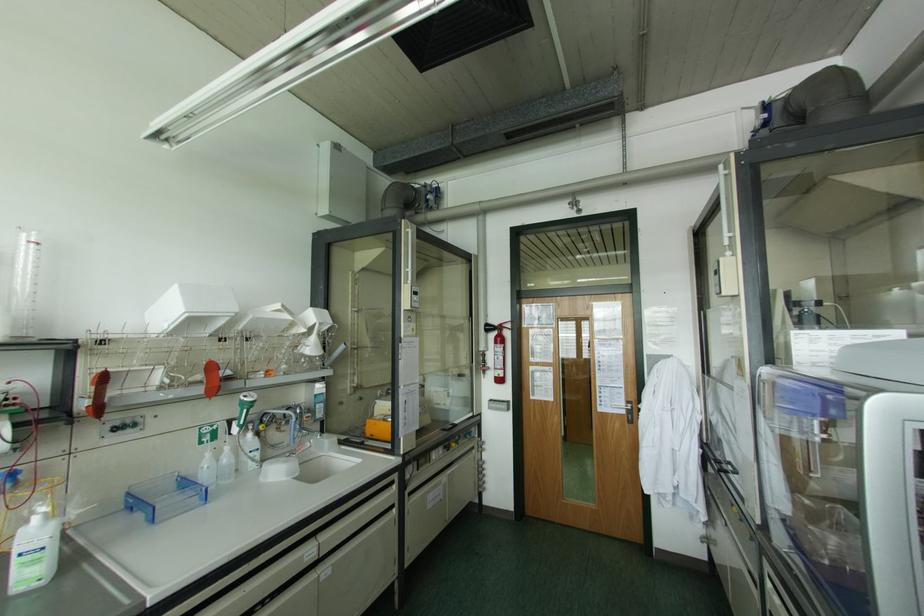
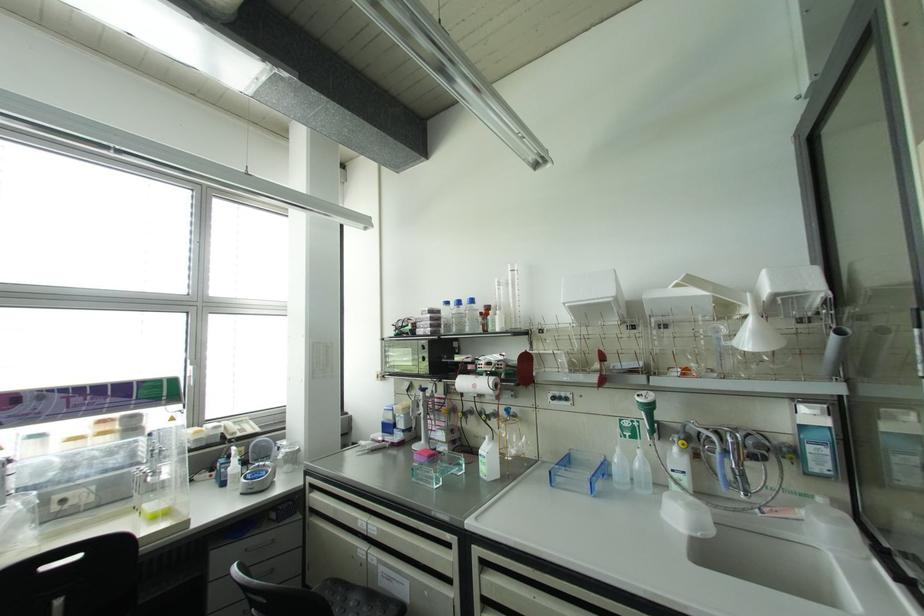
Where in the second image is the point corresponding to [241,426] from the first image?

(650, 432)